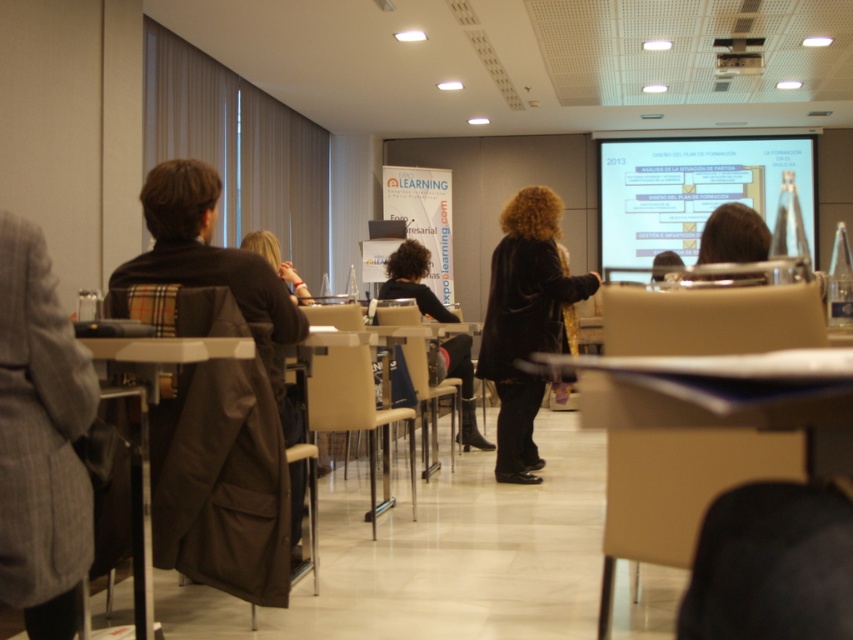
Between metallic silver table at center and beige fabric chair at center, which one is positioned lower?

Positioned lower is beige fabric chair at center.

Between point (144, 566) and point (370, 493), which one is positioned in front?

Point (144, 566)

This screenshot has height=640, width=853. What do you see at coordinates (148, 428) in the screenshot?
I see `metallic silver table at center` at bounding box center [148, 428].

Locate an element on the screen. The height and width of the screenshot is (640, 853). metallic silver table at center is located at coordinates (148, 428).

Consider the image. Is beige fabric chair at center further to the viewer compared to metallic projector at upper center?

No, it is not.

Which is below, beige fabric chair at center or metallic projector at upper center?

beige fabric chair at center is below.

What are the coordinates of `beige fabric chair at center` in the screenshot? It's located at point(354,408).

Where is `beige fabric chair at center`? beige fabric chair at center is located at coordinates (354, 408).

Can you confirm if velvet black coat at center is bigger than metallic silver table at center?

Yes, velvet black coat at center is bigger than metallic silver table at center.

Does velvet black coat at center have a lesser width compared to metallic silver table at center?

Answer: In fact, velvet black coat at center might be wider than metallic silver table at center.

Between point (517, 342) and point (129, 392), which one is positioned in front?

Point (129, 392)

Where is `velvet black coat at center`? The image size is (853, 640). velvet black coat at center is located at coordinates (525, 321).